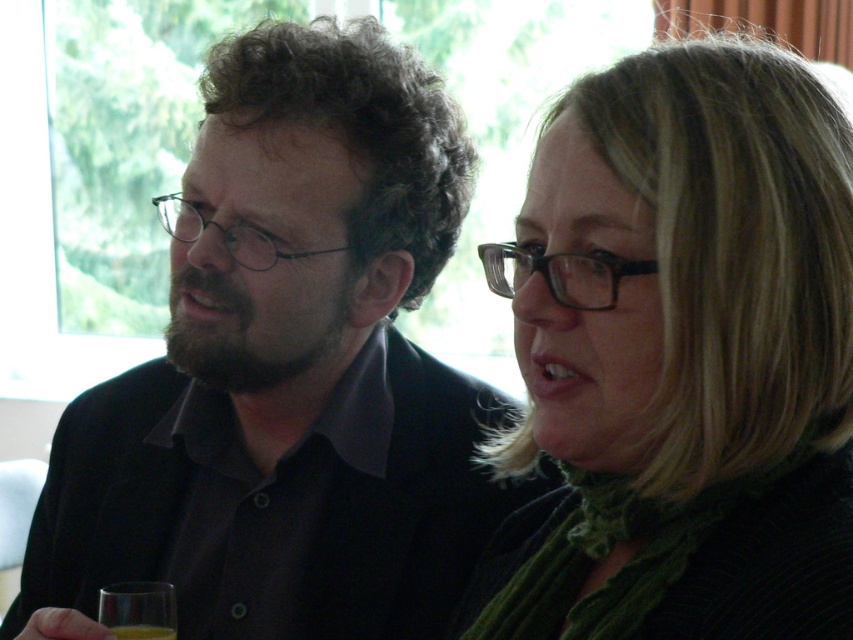
Does matte black shirt at center come in front of transparent glass at lower left?

Yes, it is.

Locate an element on the screen. This screenshot has height=640, width=853. matte black shirt at center is located at coordinates (287, 371).

Looking at this image, is green textured scarf at center positioned at the back of translucent yellow liquid at lower left?

No, green textured scarf at center is closer to the viewer.

Which is more to the left, green textured scarf at center or translucent yellow liquid at lower left?

translucent yellow liquid at lower left is more to the left.

Is point (515, 440) less distant than point (109, 628)?

Yes, it is.

You are a GUI agent. You are given a task and a screenshot of the screen. Output one action in this format:
    pyautogui.click(x=<x>, y=<y>)
    Task: Click on the green textured scarf at center
    This screenshot has height=640, width=853.
    Given the screenshot: What is the action you would take?
    pyautogui.click(x=682, y=356)

Based on the photo, can you confirm if green textured scarf at center is positioned to the left of transparent glass at lower left?

In fact, green textured scarf at center is to the right of transparent glass at lower left.

Does green textured scarf at center have a smaller size compared to transparent glass at lower left?

Actually, green textured scarf at center might be larger than transparent glass at lower left.

Image resolution: width=853 pixels, height=640 pixels. Find the location of `green textured scarf at center`. green textured scarf at center is located at coordinates (682, 356).

I want to click on green textured scarf at center, so click(682, 356).